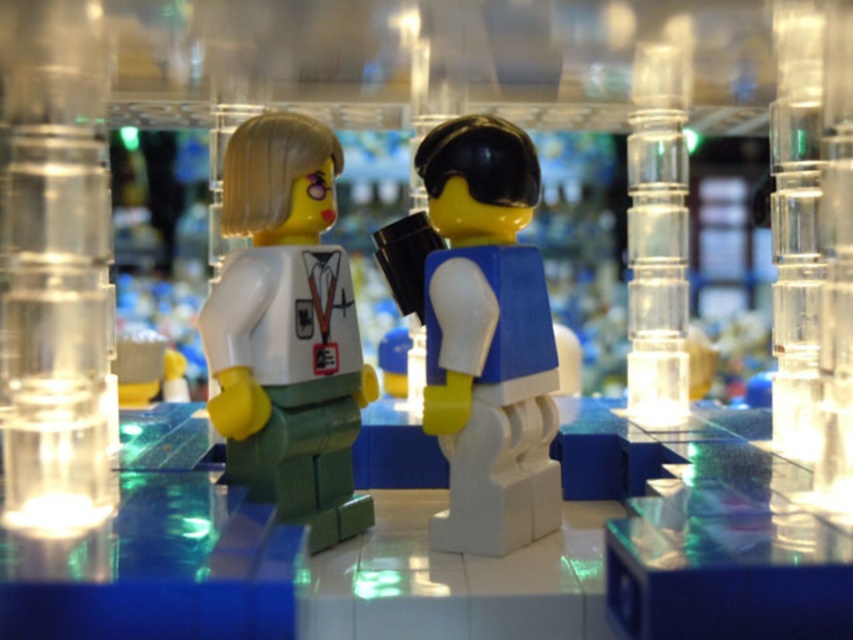
You are organizing a LEGO display and need to place a new accessory between the blue matte backpack at center and the transparent plastic pillar at right. Based on their positions, which object should the new accessory be placed closer to?

The new accessory should be placed closer to the transparent plastic pillar at right because the blue matte backpack at center is to the left of the transparent plastic pillar at right, meaning there is more space between them towards the right side.